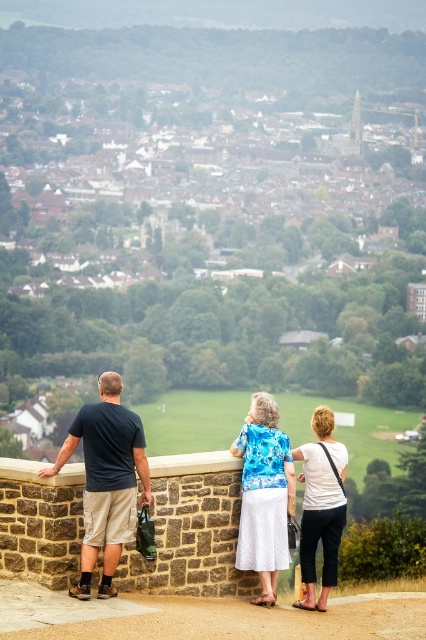
Consider the image. Can you confirm if dark blue t-shirt at left is shorter than white cotton shirt at center?

Correct, dark blue t-shirt at left is not as tall as white cotton shirt at center.

Describe the element at coordinates (106, 480) in the screenshot. I see `dark blue t-shirt at left` at that location.

Identify the location of dark blue t-shirt at left. The image size is (426, 640). (106, 480).

Between point (101, 440) and point (262, 577), which one is positioned behind?

Positioned behind is point (262, 577).

The width and height of the screenshot is (426, 640). Describe the element at coordinates (106, 480) in the screenshot. I see `dark blue t-shirt at left` at that location.

You are a GUI agent. You are given a task and a screenshot of the screen. Output one action in this format:
    pyautogui.click(x=<x>, y=<y>)
    Task: Click on the dark blue t-shirt at left
    
    Given the screenshot: What is the action you would take?
    pyautogui.click(x=106, y=480)

Is blue floral blouse at center positioned in front of white cotton shirt at center?

Yes, blue floral blouse at center is closer to the viewer.

Consider the image. Can you confirm if blue floral blouse at center is wider than white cotton shirt at center?

No, blue floral blouse at center is not wider than white cotton shirt at center.

Between point (250, 470) and point (324, 532), which one is positioned in front?

Point (250, 470) is in front.

Find the location of `blue floral blouse at center`. blue floral blouse at center is located at coordinates (264, 493).